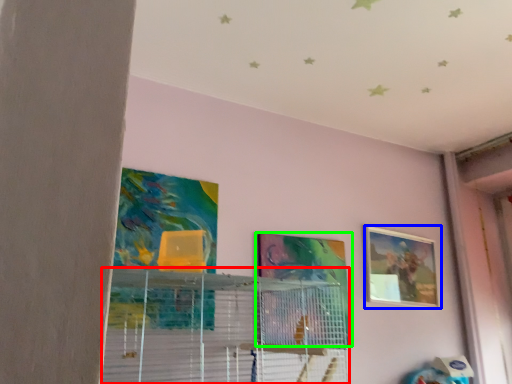
Question: Estimate the real-world distances between objects in this image. Which object is farther from shelf (highlighted by a red box), picture frame (highlighted by a blue box) or picture frame (highlighted by a green box)?

Choices:
 (A) picture frame
 (B) picture frame

Answer: (A)